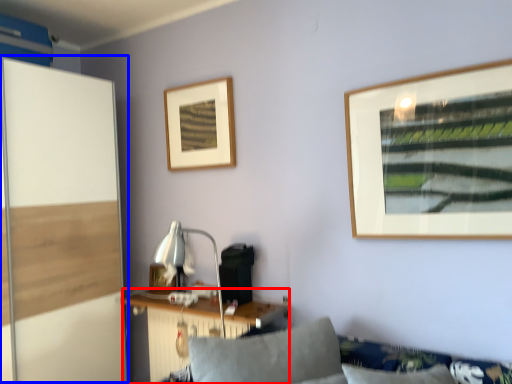
Question: Among these objects, which one is farthest to the camera, table (highlighted by a red box) or screen door (highlighted by a blue box)?

Choices:
 (A) table
 (B) screen door

Answer: (A)